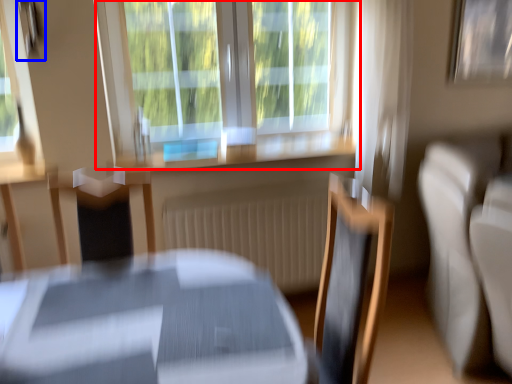
Question: Which of the following is the farthest to the observer, window (highlighted by a red box) or picture frame (highlighted by a blue box)?

Choices:
 (A) window
 (B) picture frame

Answer: (A)